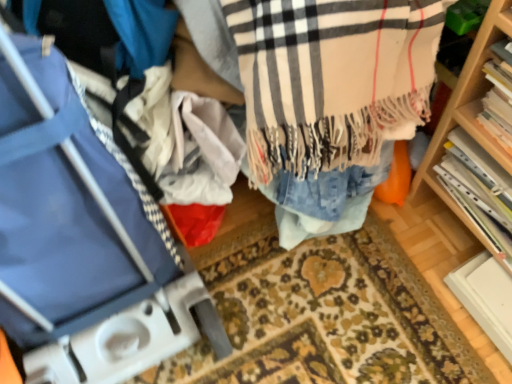
What is the approximate width of blue fabric luggage at left?

blue fabric luggage at left is 23.33 inches wide.

Find the location of a particular element. beige plaid scarf at center is located at coordinates (330, 98).

In the scene shown: Would you say beige plaid scarf at center is a long distance from blue fabric luggage at left?

No, beige plaid scarf at center is not far from blue fabric luggage at left.

Based on the photo, can you confirm if beige plaid scarf at center is taller than blue fabric luggage at left?

No, beige plaid scarf at center is not taller than blue fabric luggage at left.

From the image's perspective, would you say beige plaid scarf at center is shown under blue fabric luggage at left?

No, from the image's perspective, beige plaid scarf at center is not beneath blue fabric luggage at left.

Can you confirm if beige plaid scarf at center is shorter than hardcover book at right, which is counted as the second book, starting from the back?

Incorrect, the height of beige plaid scarf at center does not fall short of that of hardcover book at right, which is counted as the second book, starting from the back.

Would you say hardcover book at right, which is counted as the second book, starting from the back, is part of beige plaid scarf at center's contents?

That's incorrect, hardcover book at right, which is counted as the second book, starting from the back, is not inside beige plaid scarf at center.

From a real-world perspective, is beige plaid scarf at center physically below hardcover book at right, placed as the first book when sorted from front to back?

Yes.

Considering the positions of objects beige plaid scarf at center and hardcover book at right, which is counted as the second book, starting from the back, in the image provided, who is behind, beige plaid scarf at center or hardcover book at right, which is counted as the second book, starting from the back,?

hardcover book at right, which is counted as the second book, starting from the back, is more distant.

Considering the points (328, 194) and (452, 158), which point is behind, point (328, 194) or point (452, 158)?

The point (452, 158) is farther from the camera.

Is hardcover book at right, arranged as the 2th book when viewed from the front, located within beige plaid scarf at center?

No, beige plaid scarf at center does not contain hardcover book at right, arranged as the 2th book when viewed from the front.

In the scene shown: Which object is wider, beige plaid scarf at center or hardcover book at right, arranged as the 2th book when viewed from the front?

beige plaid scarf at center.

The width and height of the screenshot is (512, 384). Identify the location of clothing that appears on the left of hardcover book at right, the 1th book when ordered from back to front. (330, 98).

Can you confirm if blue fabric luggage at left is shorter than hardcover book at right, arranged as the 2th book when viewed from the front?

In fact, blue fabric luggage at left may be taller than hardcover book at right, arranged as the 2th book when viewed from the front.

Is blue fabric luggage at left directly adjacent to hardcover book at right, arranged as the 2th book when viewed from the front?

blue fabric luggage at left and hardcover book at right, arranged as the 2th book when viewed from the front, are clearly separated.

From the image's perspective, which one is positioned lower, blue fabric luggage at left or hardcover book at right, arranged as the 2th book when viewed from the front?

hardcover book at right, arranged as the 2th book when viewed from the front.

You are a GUI agent. You are given a task and a screenshot of the screen. Output one action in this format:
    pyautogui.click(x=<x>, y=<y>)
    Task: Click on the book that is the 2nd one when counting backward from the blue fabric luggage at left
    Image resolution: width=512 pixels, height=384 pixels.
    Given the screenshot: What is the action you would take?
    click(x=479, y=189)

From a real-world perspective, who is located lower, hardcover book at right, which is counted as the second book, starting from the back, or blue fabric luggage at left?

blue fabric luggage at left is physically lower.

Is hardcover book at right, which is counted as the second book, starting from the back, thinner than blue fabric luggage at left?

Yes, hardcover book at right, which is counted as the second book, starting from the back, is thinner than blue fabric luggage at left.

From the image's perspective, is hardcover book at right, which is counted as the second book, starting from the back, under blue fabric luggage at left?

No, from the image's perspective, hardcover book at right, which is counted as the second book, starting from the back, is not below blue fabric luggage at left.

Identify the location of luggage below the hardcover book at right, which is counted as the second book, starting from the back (from a real-world perspective). This screenshot has width=512, height=384. (119, 312).

Is blue fabric luggage at left inside or outside of hardcover book at right, placed as the first book when sorted from front to back?

blue fabric luggage at left lies outside hardcover book at right, placed as the first book when sorted from front to back.

Is blue fabric luggage at left to the right of hardcover book at right, which is counted as the second book, starting from the back, from the viewer's perspective?

No.

Considering the sizes of objects blue fabric luggage at left and hardcover book at right, which is counted as the second book, starting from the back, in the image provided, who is bigger, blue fabric luggage at left or hardcover book at right, which is counted as the second book, starting from the back,?

Bigger between the two is blue fabric luggage at left.

Could you tell me if hardcover book at right, the 1th book when ordered from back to front, is facing beige plaid scarf at center?

No, hardcover book at right, the 1th book when ordered from back to front, is not aimed at beige plaid scarf at center.

Is hardcover book at right, arranged as the 2th book when viewed from the front, spatially inside beige plaid scarf at center, or outside of it?

hardcover book at right, arranged as the 2th book when viewed from the front, is not inside beige plaid scarf at center, it's outside.

From the picture: Can you tell me how much hardcover book at right, the 1th book when ordered from back to front, and beige plaid scarf at center differ in facing direction?

The angular difference between hardcover book at right, the 1th book when ordered from back to front, and beige plaid scarf at center is 0.203 degrees.

Where is `clothing behind the blue fabric luggage at left`? clothing behind the blue fabric luggage at left is located at coordinates (330, 98).

At what (x,y) coordinates should I click in order to perform the action: click on clothing on the left of hardcover book at right, which is counted as the second book, starting from the back. Please return your answer as a coordinate pair (x, y). The image size is (512, 384). Looking at the image, I should click on (330, 98).

Which object lies further to the anchor point hardcover book at right, placed as the first book when sorted from front to back, beige plaid scarf at center or blue fabric luggage at left?

blue fabric luggage at left is positioned further to the anchor hardcover book at right, placed as the first book when sorted from front to back.

Based on their spatial positions, is hardcover book at right, which is counted as the second book, starting from the back, or hardcover book at right, arranged as the 2th book when viewed from the front, closer to beige plaid scarf at center?

hardcover book at right, which is counted as the second book, starting from the back, is positioned closer to the anchor beige plaid scarf at center.

Considering their positions, is hardcover book at right, the 1th book when ordered from back to front, positioned further to hardcover book at right, placed as the first book when sorted from front to back, than beige plaid scarf at center?

beige plaid scarf at center is further to hardcover book at right, placed as the first book when sorted from front to back.

Based on their spatial positions, is beige plaid scarf at center or blue fabric luggage at left further from hardcover book at right, the 1th book when ordered from back to front?

The object further to hardcover book at right, the 1th book when ordered from back to front, is blue fabric luggage at left.

Looking at the image, which one is located closer to blue fabric luggage at left, beige plaid scarf at center or hardcover book at right, placed as the first book when sorted from front to back?

Among the two, beige plaid scarf at center is located nearer to blue fabric luggage at left.

Which object lies nearer to the anchor point hardcover book at right, arranged as the 2th book when viewed from the front, beige plaid scarf at center or hardcover book at right, placed as the first book when sorted from front to back?

Based on the image, hardcover book at right, placed as the first book when sorted from front to back, appears to be nearer to hardcover book at right, arranged as the 2th book when viewed from the front.

When comparing their distances from beige plaid scarf at center, does blue fabric luggage at left or hardcover book at right, placed as the first book when sorted from front to back, seem further?

blue fabric luggage at left.

Consider the image. Looking at the image, which one is located closer to hardcover book at right, the 1th book when ordered from back to front, blue fabric luggage at left or hardcover book at right, which is counted as the second book, starting from the back?

hardcover book at right, which is counted as the second book, starting from the back.

The image size is (512, 384). I want to click on clothing between blue fabric luggage at left and hardcover book at right, the 1th book when ordered from back to front, in the horizontal direction, so click(330, 98).

Find the location of `clothing located between blue fabric luggage at left and hardcover book at right, placed as the first book when sorted from front to back, in the left-right direction`. clothing located between blue fabric luggage at left and hardcover book at right, placed as the first book when sorted from front to back, in the left-right direction is located at coordinates (330, 98).

Identify the location of book located between blue fabric luggage at left and hardcover book at right, arranged as the 2th book when viewed from the front, in the left-right direction. Image resolution: width=512 pixels, height=384 pixels. (499, 97).

Where is `book situated between beige plaid scarf at center and hardcover book at right, the 1th book when ordered from back to front, from left to right`? The height and width of the screenshot is (384, 512). book situated between beige plaid scarf at center and hardcover book at right, the 1th book when ordered from back to front, from left to right is located at coordinates (499, 97).